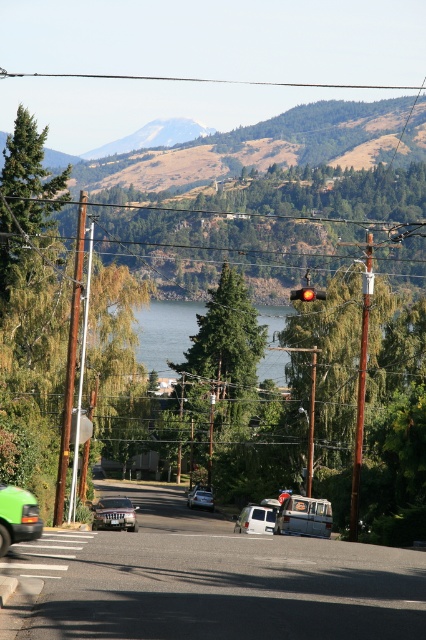
You are standing at the point with coordinates point (166, 332) in the image. What is the nearest object to you?

The nearest object to you is the green water at center because the point (166, 332) is on green water at center.